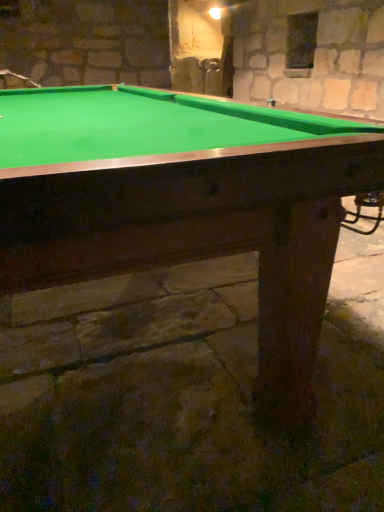
Identify the location of green felt pool table at center. (200, 219).

Measure the distance between point (167,252) and camera.

37.83 inches.

What do you see at coordinates (200, 219) in the screenshot?
I see `green felt pool table at center` at bounding box center [200, 219].

At what (x,y) coordinates should I click in order to perform the action: click on green felt pool table at center. Please return your answer as a coordinate pair (x, y). The image size is (384, 512). Looking at the image, I should click on (200, 219).